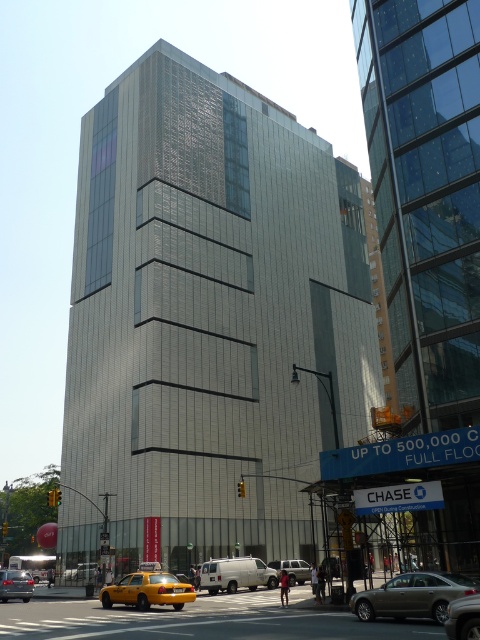
You are a delivery person trying to park your van between the yellow matte taxi at lower left and the metallic silver sedan at lower right. Can you fit your van, which is 2 meters wide, in the space between them?

The yellow matte taxi at lower left is wider than the metallic silver sedan at lower right. However, the exact width of the space between them isn

You are standing at the center of the image looking towards the tall building. Which object from the following list is located closest to the bottom right corner of the image? List the object exactly as it appears in the options. Options are gold metallic sedan at lower right, white van in the middle.

The gold metallic sedan at lower right is located closest to the bottom right corner of the image because its 2D coordinates at point (412, 595) place it near the lower right quadrant.